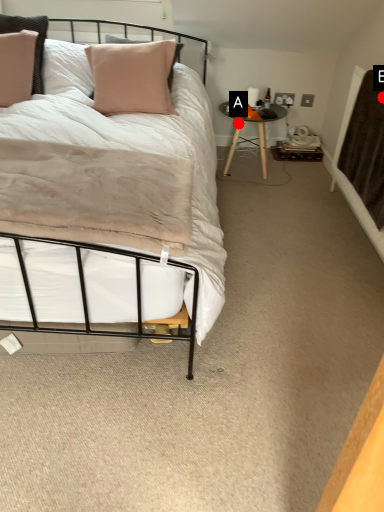
Question: Two points are circled on the image, labeled by A and B beside each circle. Which point is further to the camera?

Choices:
 (A) A is further
 (B) B is further

Answer: (A)